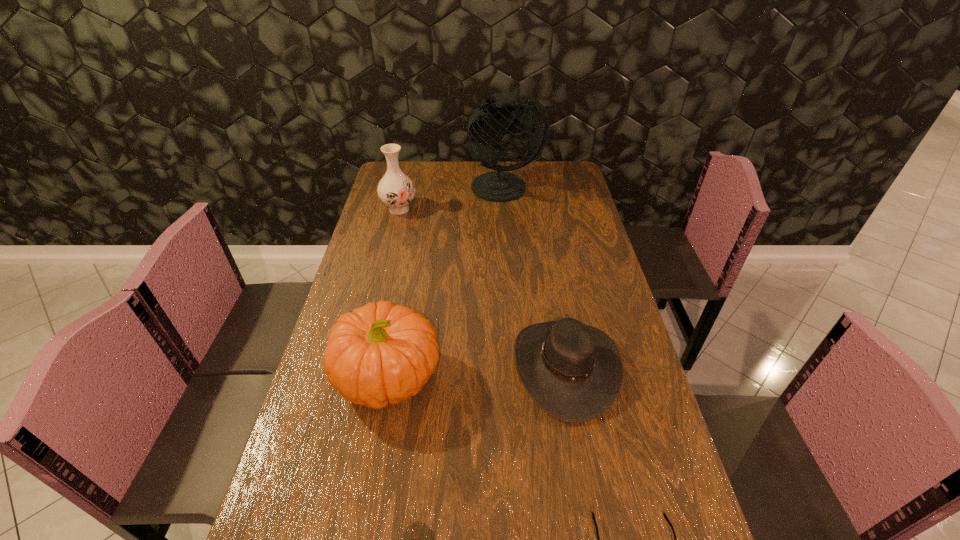
You are a GUI agent. You are given a task and a screenshot of the screen. Output one action in this format:
    pyautogui.click(x=<x>, y=<y>)
    Task: Click on the globe
    
    Given the screenshot: What is the action you would take?
    pyautogui.click(x=489, y=119)

Image resolution: width=960 pixels, height=540 pixels. I want to click on vase, so click(396, 190).

Find the location of a particular element. pumpkin is located at coordinates (381, 353).

The width and height of the screenshot is (960, 540). Find the location of `cowboy hat`. cowboy hat is located at coordinates (574, 372).

The image size is (960, 540). In order to click on vacant space situated on the front-facing side of the tallest object in this screenshot , I will do `click(509, 226)`.

You are a GUI agent. You are given a task and a screenshot of the screen. Output one action in this format:
    pyautogui.click(x=<x>, y=<y>)
    Task: Click on the free space located on the back of the vase
    Image resolution: width=960 pixels, height=540 pixels.
    Given the screenshot: What is the action you would take?
    pyautogui.click(x=406, y=180)

Where is `vacant point located on the surface of the pumpkin`? This screenshot has width=960, height=540. vacant point located on the surface of the pumpkin is located at coordinates (507, 377).

You are a GUI agent. You are given a task and a screenshot of the screen. Output one action in this format:
    pyautogui.click(x=<x>, y=<y>)
    Task: Click on the free region located 0.200m on the front-facing side of the cowboy hat
    The height and width of the screenshot is (540, 960).
    Given the screenshot: What is the action you would take?
    pyautogui.click(x=439, y=367)

You are a GUI agent. You are given a task and a screenshot of the screen. Output one action in this format:
    pyautogui.click(x=<x>, y=<y>)
    Task: Click on the vacant region located on the front-facing side of the cowboy hat
    
    Given the screenshot: What is the action you would take?
    pyautogui.click(x=431, y=367)

This screenshot has height=540, width=960. I want to click on vacant space located on the front-facing side of the cowboy hat, so click(390, 367).